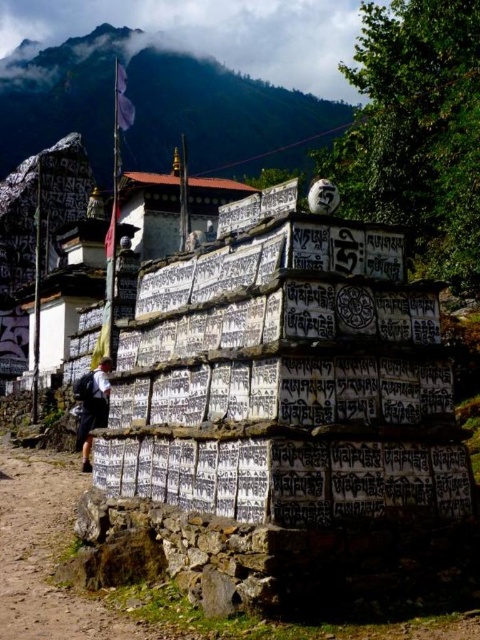
Question: Is white stone prayer wheel at center smaller than brown dirt track at lower left?

Choices:
 (A) no
 (B) yes

Answer: (A)

Question: Which of the following is the farthest from the observer?

Choices:
 (A) white fabric backpack at lower left
 (B) brown dirt track at lower left
 (C) green grassy mountain at upper center
 (D) white stone prayer wheel at center

Answer: (C)

Question: Which object appears closest to the camera in this image?

Choices:
 (A) white fabric backpack at lower left
 (B) white stone prayer wheel at center
 (C) brown dirt track at lower left

Answer: (C)

Question: Is green grassy mountain at upper center above white fabric backpack at lower left?

Choices:
 (A) yes
 (B) no

Answer: (A)

Question: Which point appears farthest from the camera in this image?

Choices:
 (A) (56, 532)
 (B) (75, 42)

Answer: (B)

Question: Is green grassy mountain at upper center below white fabric backpack at lower left?

Choices:
 (A) yes
 (B) no

Answer: (B)